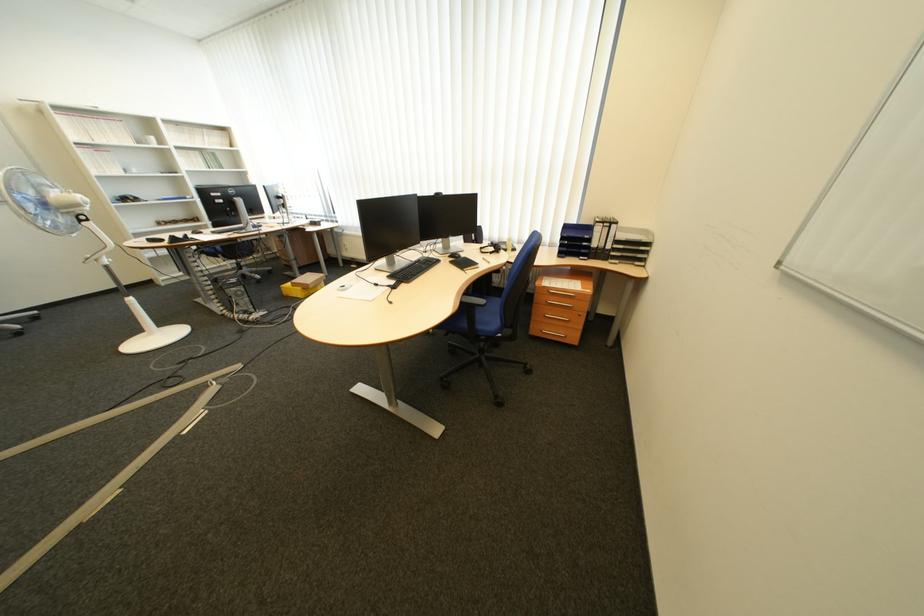
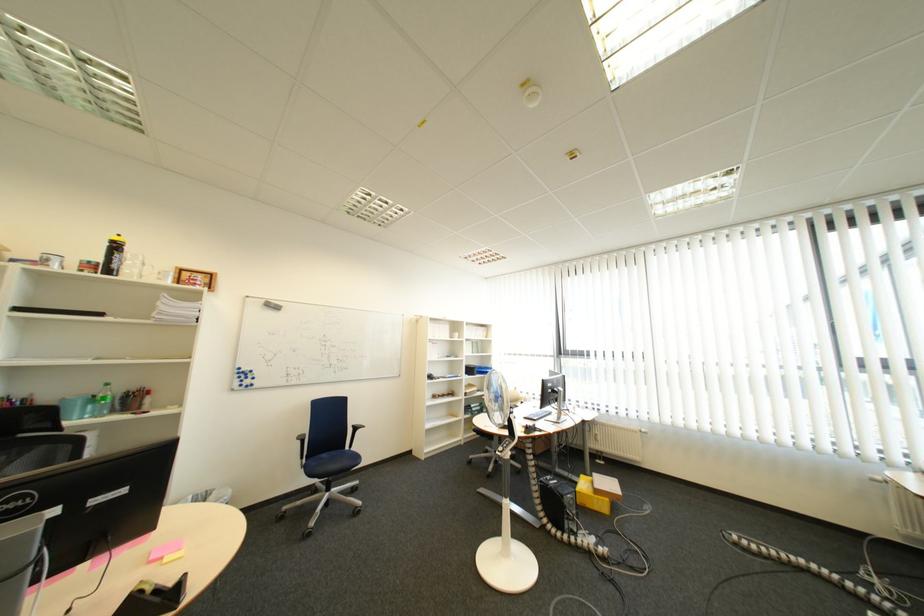
Locate, in the second image, the point that corresponds to (x=252, y=294) in the first image.

(585, 503)